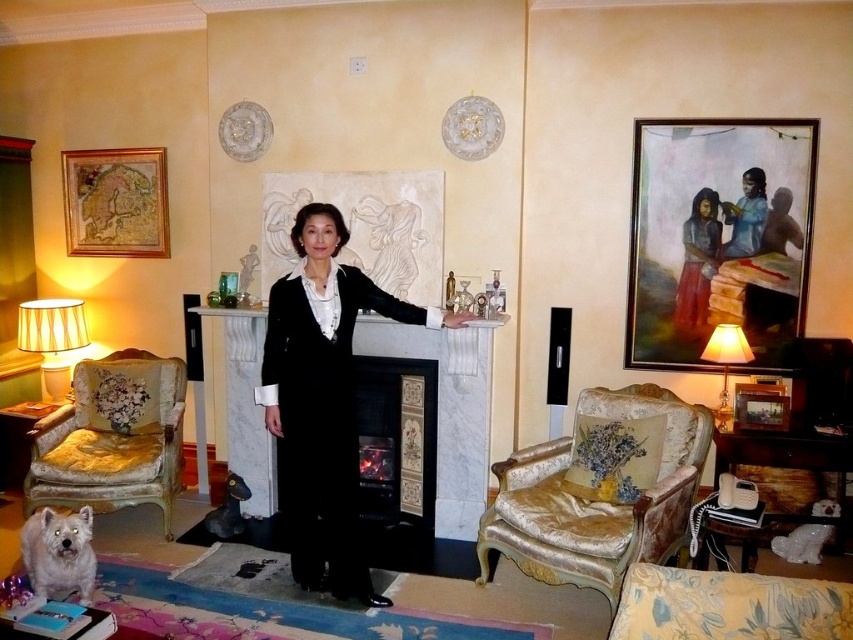
Question: Which object is closer to the camera taking this photo?

Choices:
 (A) white glossy side table at lower right
 (B) black silk dress at center

Answer: (B)

Question: Considering the real-world distances, which object is farthest from the gold velvet armchair at lower left?

Choices:
 (A) floral fabric armchair at center
 (B) white fluffy dog at lower left
 (C) oil painting at upper right

Answer: (C)

Question: Is black tiled fireplace at center bigger than white fluffy dog at lower left?

Choices:
 (A) no
 (B) yes

Answer: (B)

Question: Is oil painting at upper right wider than gold velvet armchair at lower left?

Choices:
 (A) no
 (B) yes

Answer: (B)

Question: Can you confirm if floral fabric armchair at center is wider than white glossy side table at lower right?

Choices:
 (A) no
 (B) yes

Answer: (A)

Question: Among these points, which one is nearest to the camera?

Choices:
 (A) (666, 460)
 (B) (769, 422)
 (C) (717, 589)

Answer: (C)